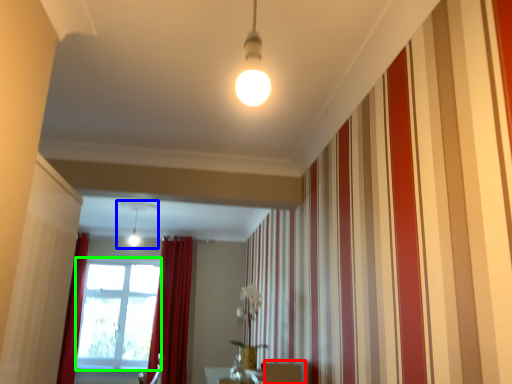
Question: Which is farther away from furniture (highlighted by a red box)? light fixture (highlighted by a blue box) or window screen (highlighted by a green box)?

Choices:
 (A) light fixture
 (B) window screen

Answer: (B)